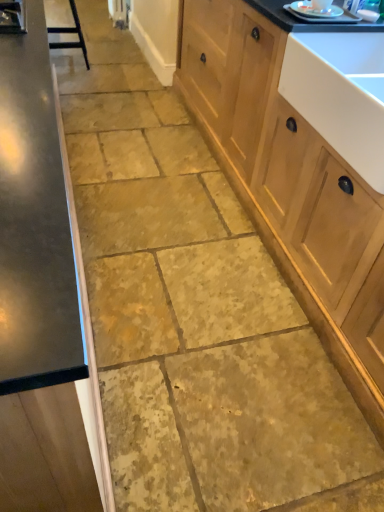
Question: Is black metal bar stool at upper left next to wooden cabinet at right, placed as the first cabinetry when sorted from right to left?

Choices:
 (A) yes
 (B) no

Answer: (B)

Question: Can you confirm if black metal bar stool at upper left is positioned to the right of wooden cabinet at right, placed as the first cabinetry when sorted from right to left?

Choices:
 (A) yes
 (B) no

Answer: (B)

Question: Considering the relative sizes of black metal bar stool at upper left and wooden cabinet at right, which appears as the second cabinetry when viewed from the left, in the image provided, is black metal bar stool at upper left shorter than wooden cabinet at right, which appears as the second cabinetry when viewed from the left,?

Choices:
 (A) no
 (B) yes

Answer: (B)

Question: Does black metal bar stool at upper left turn towards wooden cabinet at right, which appears as the second cabinetry when viewed from the left?

Choices:
 (A) no
 (B) yes

Answer: (A)

Question: Does black metal bar stool at upper left have a smaller size compared to wooden cabinet at right, placed as the first cabinetry when sorted from right to left?

Choices:
 (A) yes
 (B) no

Answer: (A)

Question: Is black metal bar stool at upper left positioned behind wooden cabinet at right, which appears as the second cabinetry when viewed from the left?

Choices:
 (A) no
 (B) yes

Answer: (B)

Question: From a real-world perspective, is metallic silver plate at upper right on top of black metal bar stool at upper left?

Choices:
 (A) yes
 (B) no

Answer: (A)

Question: Would you say metallic silver plate at upper right is a long distance from black metal bar stool at upper left?

Choices:
 (A) no
 (B) yes

Answer: (B)

Question: Is metallic silver plate at upper right shorter than black metal bar stool at upper left?

Choices:
 (A) no
 (B) yes

Answer: (B)

Question: Considering the relative sizes of metallic silver plate at upper right and black metal bar stool at upper left in the image provided, is metallic silver plate at upper right thinner than black metal bar stool at upper left?

Choices:
 (A) yes
 (B) no

Answer: (A)

Question: From the image's perspective, is metallic silver plate at upper right below black metal bar stool at upper left?

Choices:
 (A) no
 (B) yes

Answer: (B)

Question: Considering the relative sizes of metallic silver plate at upper right and black metal bar stool at upper left in the image provided, is metallic silver plate at upper right bigger than black metal bar stool at upper left?

Choices:
 (A) no
 (B) yes

Answer: (A)

Question: Does black metal bar stool at upper left have a lesser width compared to satin wood cabinet at left, the 1th cabinetry in the left-to-right sequence?

Choices:
 (A) yes
 (B) no

Answer: (A)